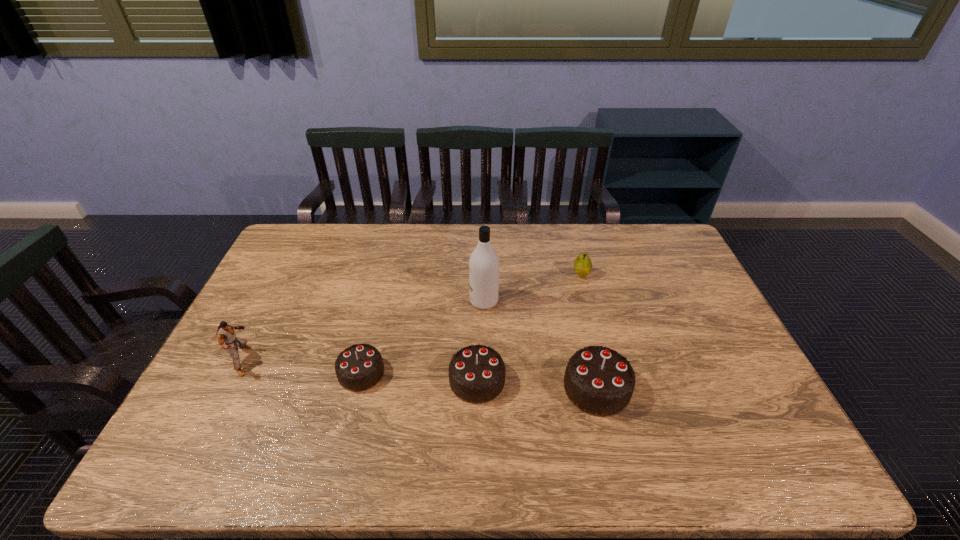
All chocolate cakes are currently evenly spaced. To continue this pattern, where would you add another chocolate cake on the right? Please point out a vacant spot. Please provide its 2D coordinates. Your answer should be formatted as a tuple, i.e. [(x, y)], where the tuple contains the x and y coordinates of a point satisfying the conditions above.

[(720, 396)]